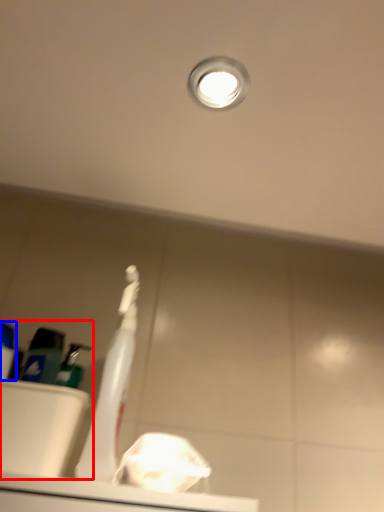
Question: Among these objects, which one is farthest to the camera, sink (highlighted by a red box) or toiletry (highlighted by a blue box)?

Choices:
 (A) sink
 (B) toiletry

Answer: (A)